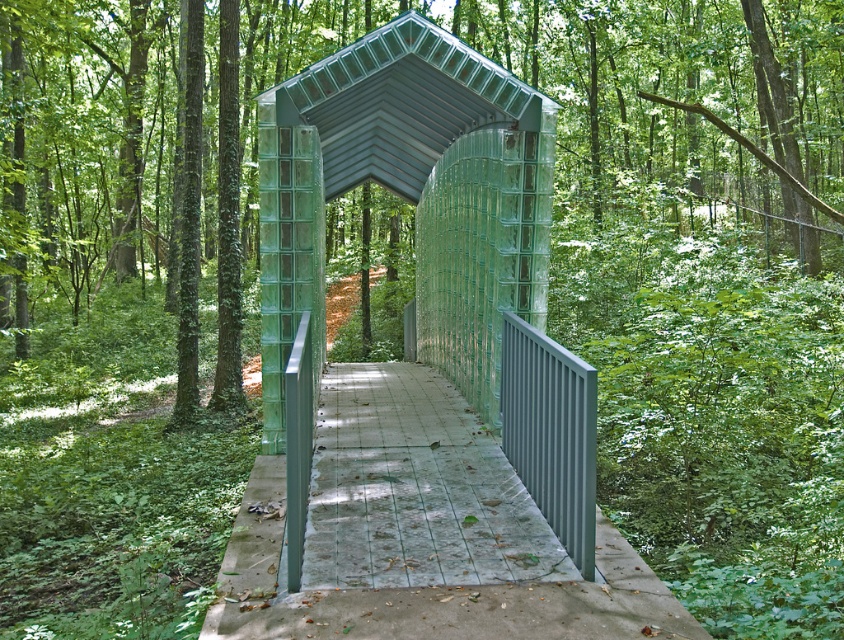
Can you confirm if transparent glass gazebo at center is positioned below smooth concrete path at center?

No, transparent glass gazebo at center is not below smooth concrete path at center.

Is transparent glass gazebo at center behind smooth concrete path at center?

No.

Is point (377, 124) more distant than point (339, 579)?

Yes, it is behind point (339, 579).

At what (x,y) coordinates should I click in order to perform the action: click on transparent glass gazebo at center. Please return your answer as a coordinate pair (x, y). The image size is (844, 640). Looking at the image, I should click on (434, 243).